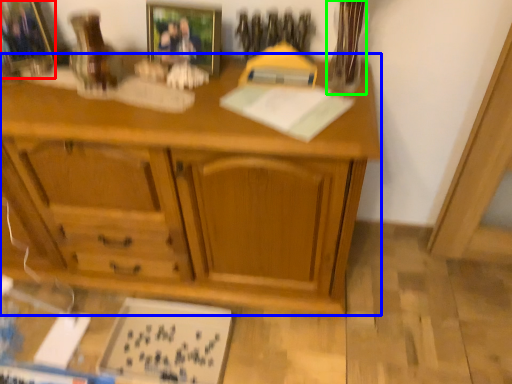
Question: Which object is positioned closest to picture frame (highlighted by a red box)? Select from desk (highlighted by a blue box) and glass vase (highlighted by a green box).

Choices:
 (A) desk
 (B) glass vase

Answer: (A)